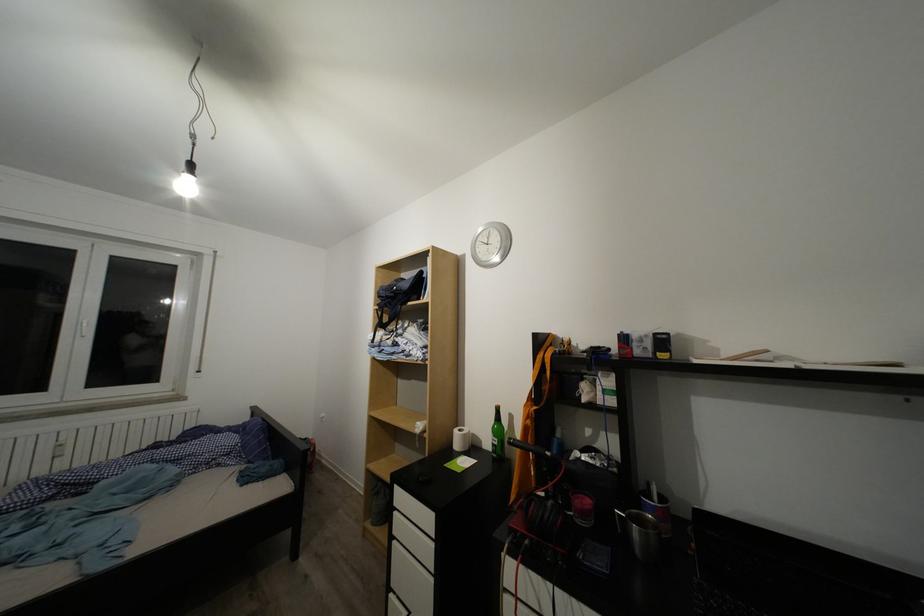
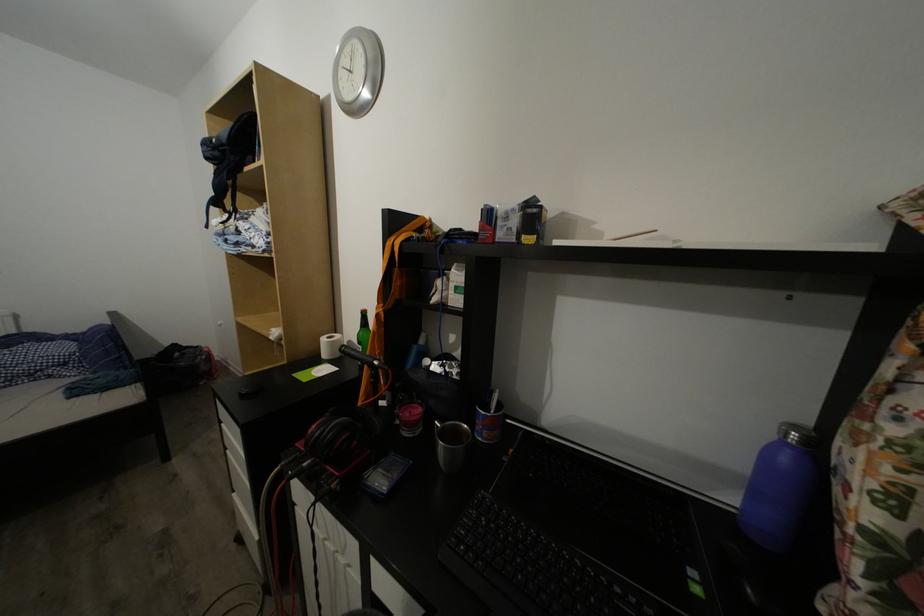
Question: How did the camera likely rotate?

Choices:
 (A) Left
 (B) Right
 (C) Up
 (D) Down

Answer: (D)